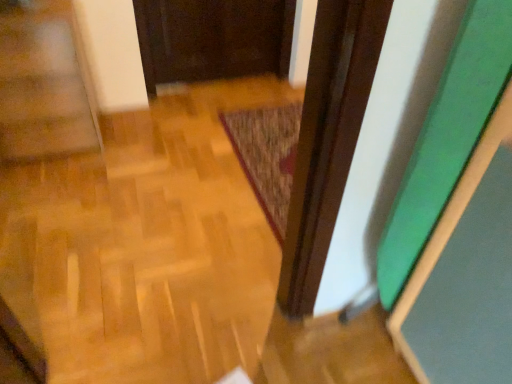
Where is `wooden parquet floor at lower left`? Image resolution: width=512 pixels, height=384 pixels. wooden parquet floor at lower left is located at coordinates (44, 85).

This screenshot has height=384, width=512. What do you see at coordinates (44, 85) in the screenshot?
I see `wooden parquet floor at lower left` at bounding box center [44, 85].

This screenshot has height=384, width=512. What are the coordinates of `textured brown mat at center` in the screenshot? It's located at (267, 156).

The image size is (512, 384). Describe the element at coordinates (267, 156) in the screenshot. I see `textured brown mat at center` at that location.

Where is `wooden parquet floor at lower left`? The height and width of the screenshot is (384, 512). wooden parquet floor at lower left is located at coordinates [x=44, y=85].

In the image, is textured brown mat at center on the left side or the right side of wooden parquet floor at lower left?

textured brown mat at center is positioned on wooden parquet floor at lower left's right side.

In the scene shown: Which is in front, textured brown mat at center or wooden parquet floor at lower left?

wooden parquet floor at lower left.

Is point (272, 164) in front of point (65, 132)?

No.

From the image's perspective, would you say textured brown mat at center is positioned over wooden parquet floor at lower left?

No, from the image's perspective, textured brown mat at center is not on top of wooden parquet floor at lower left.

From a real-world perspective, is textured brown mat at center physically located above or below wooden parquet floor at lower left?

Clearly, from a real-world perspective, textured brown mat at center is below wooden parquet floor at lower left.

Is textured brown mat at center wider than wooden parquet floor at lower left?

Indeed, textured brown mat at center has a greater width compared to wooden parquet floor at lower left.

Considering the sizes of objects textured brown mat at center and wooden parquet floor at lower left in the image provided, who is shorter, textured brown mat at center or wooden parquet floor at lower left?

textured brown mat at center is shorter.

Considering the sizes of objects textured brown mat at center and wooden parquet floor at lower left in the image provided, who is smaller, textured brown mat at center or wooden parquet floor at lower left?

Smaller between the two is textured brown mat at center.

Is textured brown mat at center spatially inside wooden parquet floor at lower left, or outside of it?

The correct answer is: outside.

In the scene shown: Is textured brown mat at center next to wooden parquet floor at lower left and touching it?

No, textured brown mat at center is not beside wooden parquet floor at lower left.

Is textured brown mat at center looking in the opposite direction of wooden parquet floor at lower left?

No, textured brown mat at center is not facing away from wooden parquet floor at lower left.

How different are the orientations of textured brown mat at center and wooden parquet floor at lower left in degrees?

The facing directions of textured brown mat at center and wooden parquet floor at lower left are 90 degrees apart.

How far apart are textured brown mat at center and wooden parquet floor at lower left?

textured brown mat at center is 36.25 inches from wooden parquet floor at lower left.

At what (x,y) coordinates should I click in order to perform the action: click on mat located underneath the wooden parquet floor at lower left (from a real-world perspective). Please return your answer as a coordinate pair (x, y). The width and height of the screenshot is (512, 384). Looking at the image, I should click on (267, 156).

Which is more to the right, wooden parquet floor at lower left or textured brown mat at center?

textured brown mat at center is more to the right.

Looking at this image, considering their positions, is wooden parquet floor at lower left located in front of or behind textured brown mat at center?

wooden parquet floor at lower left is in front of textured brown mat at center.

Which is in front, point (47, 69) or point (296, 131)?

Positioned in front is point (47, 69).

From the image's perspective, which one is positioned lower, wooden parquet floor at lower left or textured brown mat at center?

From the image's view, textured brown mat at center is below.

Consider the image. From a real-world perspective, is wooden parquet floor at lower left located higher than textured brown mat at center?

Yes, from a real-world perspective, wooden parquet floor at lower left is above textured brown mat at center.

Which object is thinner, wooden parquet floor at lower left or textured brown mat at center?

wooden parquet floor at lower left is thinner.

Considering the relative sizes of wooden parquet floor at lower left and textured brown mat at center in the image provided, is wooden parquet floor at lower left shorter than textured brown mat at center?

In fact, wooden parquet floor at lower left may be taller than textured brown mat at center.

Between wooden parquet floor at lower left and textured brown mat at center, which one has smaller size?

Smaller between the two is textured brown mat at center.

Is wooden parquet floor at lower left not inside textured brown mat at center?

Yes.

Is wooden parquet floor at lower left not near textured brown mat at center?

No.

Is wooden parquet floor at lower left facing away from textured brown mat at center?

That's not correct — wooden parquet floor at lower left is not looking away from textured brown mat at center.

What's the angular difference between wooden parquet floor at lower left and textured brown mat at center's facing directions?

90 degrees.

Where is `stairwell in front of the textured brown mat at center`? Image resolution: width=512 pixels, height=384 pixels. stairwell in front of the textured brown mat at center is located at coordinates (44, 85).

The image size is (512, 384). Find the location of `mat to the right of wooden parquet floor at lower left`. mat to the right of wooden parquet floor at lower left is located at coordinates (267, 156).

Find the location of `stairwell to the left of textured brown mat at center`. stairwell to the left of textured brown mat at center is located at coordinates click(44, 85).